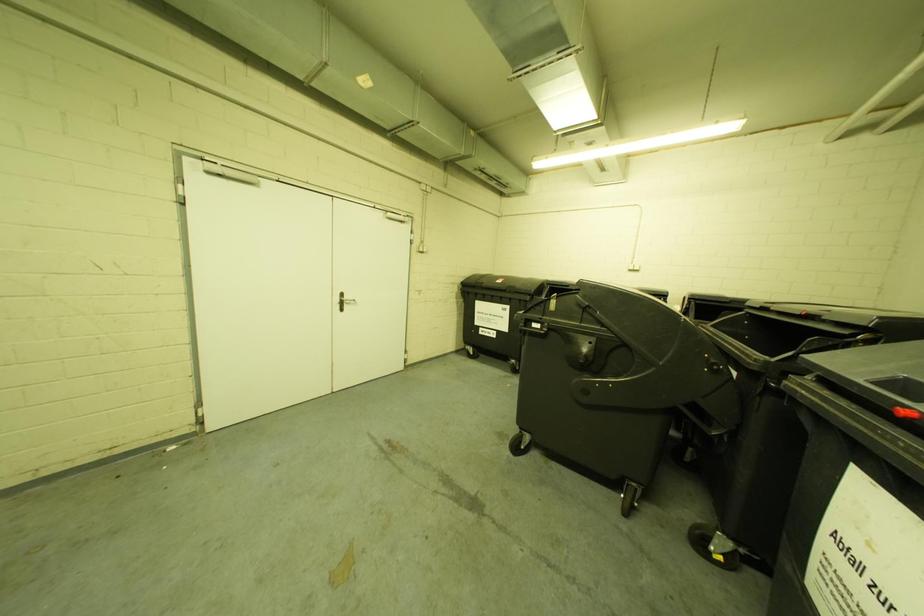
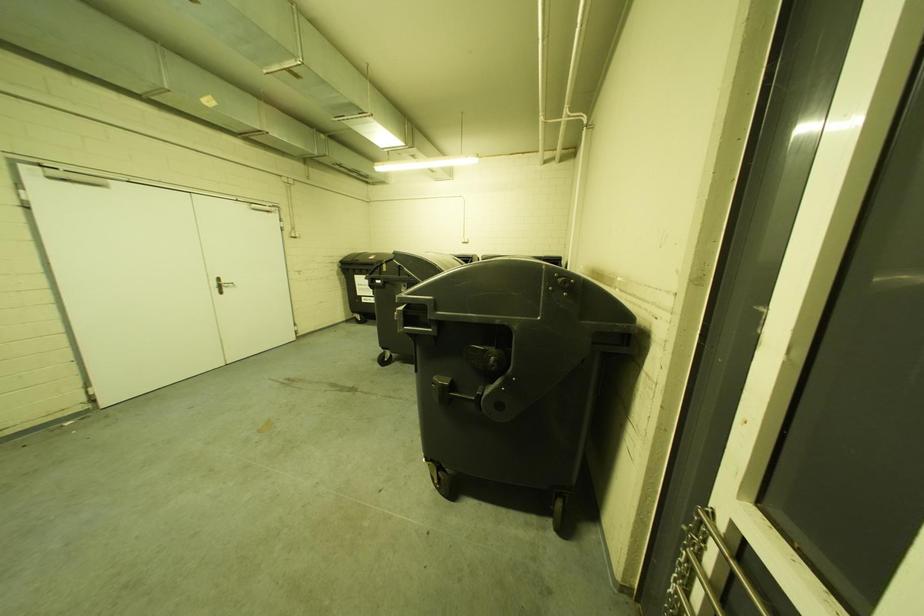
Question: Which direction would the cameraman need to move to produce the second image? Reply with the corresponding letter.

Choices:
 (A) Left
 (B) Right
 (C) Forward
 (D) Backward

Answer: (D)